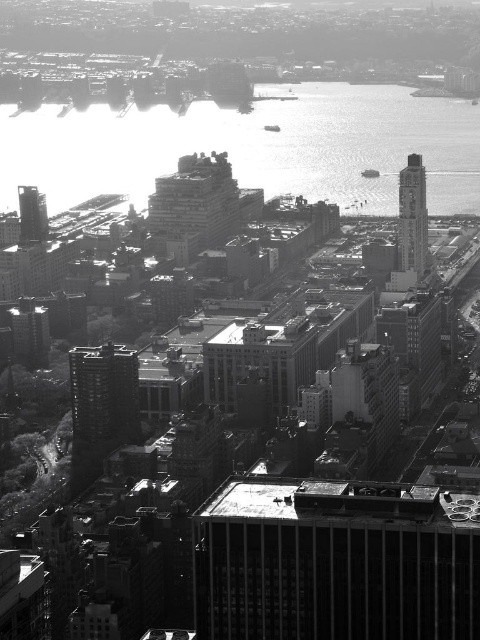
Does reflective silver water at upper center appear on the right side of concrete building at center?

Correct, you'll find reflective silver water at upper center to the right of concrete building at center.

Is reflective silver water at upper center below concrete building at center?

Incorrect, reflective silver water at upper center is not positioned below concrete building at center.

Describe the element at coordinates (253, 147) in the screenshot. This screenshot has width=480, height=640. I see `reflective silver water at upper center` at that location.

Find the location of a particular element. This screenshot has width=480, height=640. reflective silver water at upper center is located at coordinates (253, 147).

Which is more to the left, reflective silver water at upper center or smooth glass clock tower at right?

reflective silver water at upper center

Measure the distance between point [342,168] and camera.

A distance of 649.46 meters exists between point [342,168] and camera.

The width and height of the screenshot is (480, 640). What do you see at coordinates (253, 147) in the screenshot?
I see `reflective silver water at upper center` at bounding box center [253, 147].

Locate an element on the screen. The image size is (480, 640). reflective silver water at upper center is located at coordinates (253, 147).

Which is more to the right, reflective silver water at upper center or smooth concrete skyscraper at left?

Positioned to the right is reflective silver water at upper center.

Who is shorter, reflective silver water at upper center or smooth concrete skyscraper at left?

With less height is smooth concrete skyscraper at left.

Where is `reflective silver water at upper center`? The image size is (480, 640). reflective silver water at upper center is located at coordinates click(253, 147).